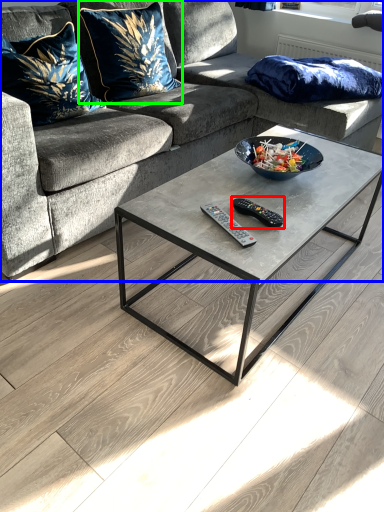
Question: Based on their relative distances, which object is nearer to remote (highlighted by a red box)? Choose from studio couch (highlighted by a blue box) and pillow (highlighted by a green box).

Choices:
 (A) studio couch
 (B) pillow

Answer: (A)